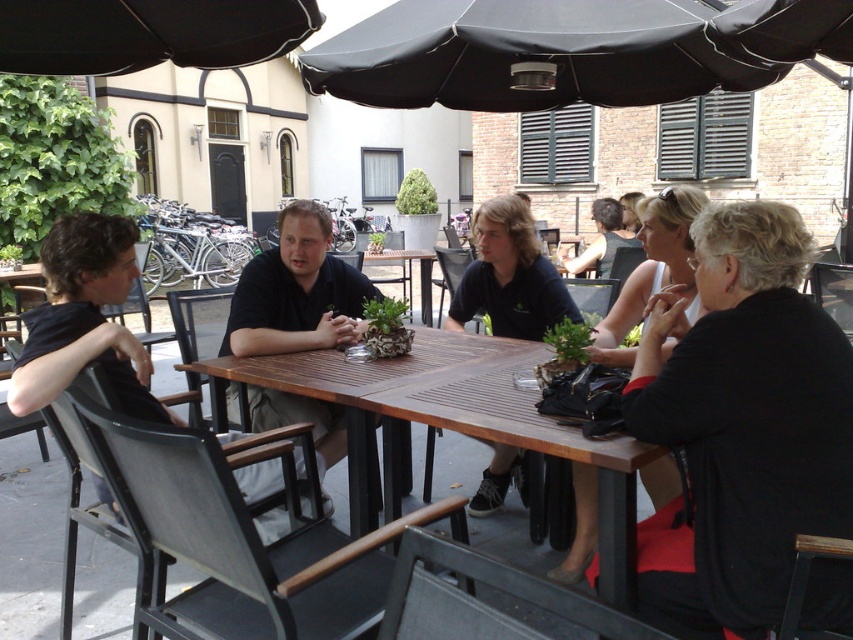
Can you confirm if black fabric shirt at left is wider than black fabric dress at right?

Indeed, black fabric shirt at left has a greater width compared to black fabric dress at right.

Who is more forward, (126, 288) or (660, 221)?

Point (126, 288) is more forward.

Find the location of a particular element. black fabric shirt at left is located at coordinates click(85, 320).

Between black fabric shirt at left and dark blue shirt at center, which one is positioned higher?

dark blue shirt at center is higher up.

Is black fabric shirt at left smaller than dark blue shirt at center?

Incorrect, black fabric shirt at left is not smaller in size than dark blue shirt at center.

Between point (106, 337) and point (503, 246), which one is positioned behind?

The point (503, 246) is more distant.

Where is `black fabric shirt at left`? Image resolution: width=853 pixels, height=640 pixels. black fabric shirt at left is located at coordinates (85, 320).

Is black matte jacket at lower right shorter than black fabric umbrella at upper left?

No.

Can you confirm if black matte jacket at lower right is positioned below black fabric umbrella at upper left?

Indeed, black matte jacket at lower right is positioned under black fabric umbrella at upper left.

The height and width of the screenshot is (640, 853). Describe the element at coordinates (741, 426) in the screenshot. I see `black matte jacket at lower right` at that location.

What are the coordinates of `black matte jacket at lower right` in the screenshot? It's located at (741, 426).